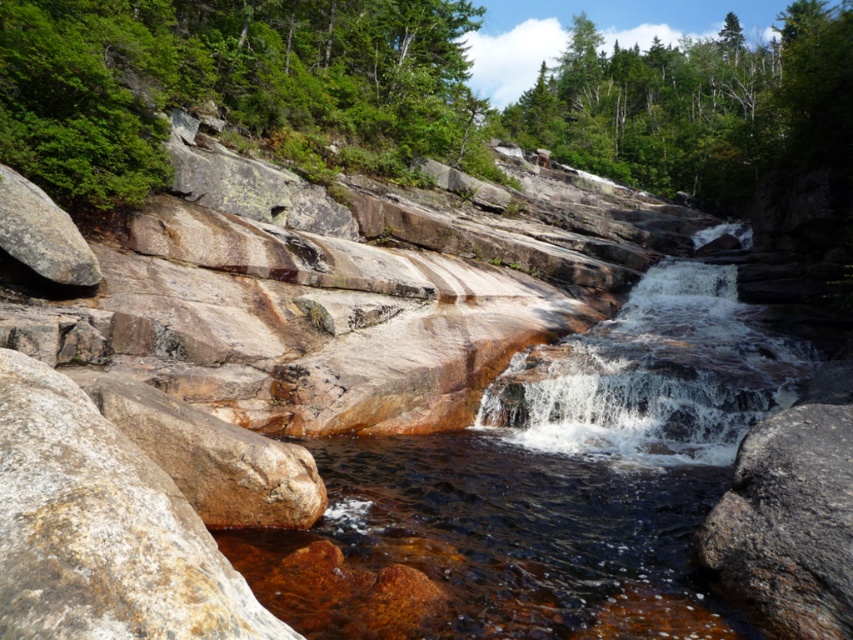
Can you confirm if rusty stone stream at center is smaller than translucent water at center?

No.

Which is behind, point (695, 358) or point (569, 384)?

The point (695, 358) is behind.

The height and width of the screenshot is (640, 853). Find the location of `rusty stone stream at center`. rusty stone stream at center is located at coordinates (552, 481).

Can you confirm if green rough rock at upper left is positioned to the right of brown rough rock at lower left?

No, green rough rock at upper left is not to the right of brown rough rock at lower left.

Measure the distance from green rough rock at upper left to brown rough rock at lower left.

green rough rock at upper left is 20.13 meters away from brown rough rock at lower left.

Describe the element at coordinates (225, 83) in the screenshot. I see `green rough rock at upper left` at that location.

The width and height of the screenshot is (853, 640). What are the coordinates of `green rough rock at upper left` in the screenshot? It's located at (225, 83).

Which is in front, point (44, 497) or point (666, 161)?

Point (44, 497)

You are a GUI agent. You are given a task and a screenshot of the screen. Output one action in this format:
    pyautogui.click(x=<x>, y=<y>)
    Task: Click on the brown rough rock at lower left
    This screenshot has height=640, width=853.
    Given the screenshot: What is the action you would take?
    pyautogui.click(x=102, y=529)

This screenshot has height=640, width=853. Identify the location of brown rough rock at lower left. (102, 529).